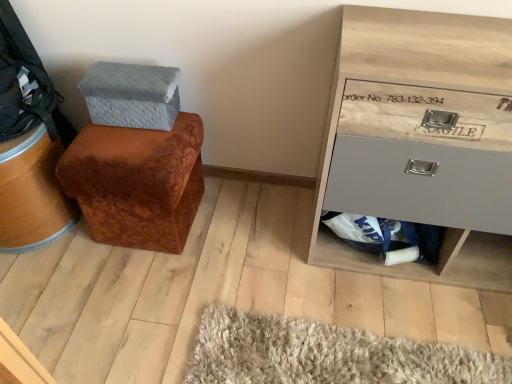
Question: Can you confirm if brown velvety ottoman at left is bigger than textured gray shoe box at upper left?

Choices:
 (A) yes
 (B) no

Answer: (A)

Question: Is brown velvety ottoman at left to the right of textured gray shoe box at upper left from the viewer's perspective?

Choices:
 (A) yes
 (B) no

Answer: (A)

Question: Considering the relative sizes of brown velvety ottoman at left and textured gray shoe box at upper left in the image provided, is brown velvety ottoman at left taller than textured gray shoe box at upper left?

Choices:
 (A) no
 (B) yes

Answer: (B)

Question: Is brown velvety ottoman at left positioned behind textured gray shoe box at upper left?

Choices:
 (A) no
 (B) yes

Answer: (A)

Question: Is brown velvety ottoman at left surrounding textured gray shoe box at upper left?

Choices:
 (A) no
 (B) yes

Answer: (A)

Question: From the image's perspective, relative to brown velvety ottoman at left, is wooden drawer at right above or below?

Choices:
 (A) above
 (B) below

Answer: (A)

Question: In terms of height, does wooden drawer at right look taller or shorter compared to brown velvety ottoman at left?

Choices:
 (A) short
 (B) tall

Answer: (B)

Question: In the image, is wooden drawer at right on the left side or the right side of brown velvety ottoman at left?

Choices:
 (A) right
 (B) left

Answer: (A)

Question: Is wooden drawer at right in front of or behind brown velvety ottoman at left in the image?

Choices:
 (A) behind
 (B) front

Answer: (B)

Question: Is brown velvety ottoman at left inside or outside of textured gray shoe box at upper left?

Choices:
 (A) outside
 (B) inside

Answer: (A)

Question: Looking at the image, does brown velvety ottoman at left seem bigger or smaller compared to textured gray shoe box at upper left?

Choices:
 (A) big
 (B) small

Answer: (A)

Question: In terms of width, does brown velvety ottoman at left look wider or thinner when compared to textured gray shoe box at upper left?

Choices:
 (A) wide
 (B) thin

Answer: (A)

Question: Based on their positions, is brown velvety ottoman at left located to the left or right of textured gray shoe box at upper left?

Choices:
 (A) right
 (B) left

Answer: (A)

Question: Would you say brown velvety ottoman at left is to the left or to the right of wooden drawer at right in the picture?

Choices:
 (A) right
 (B) left

Answer: (B)

Question: From the image's perspective, relative to wooden drawer at right, is brown velvety ottoman at left above or below?

Choices:
 (A) below
 (B) above

Answer: (A)